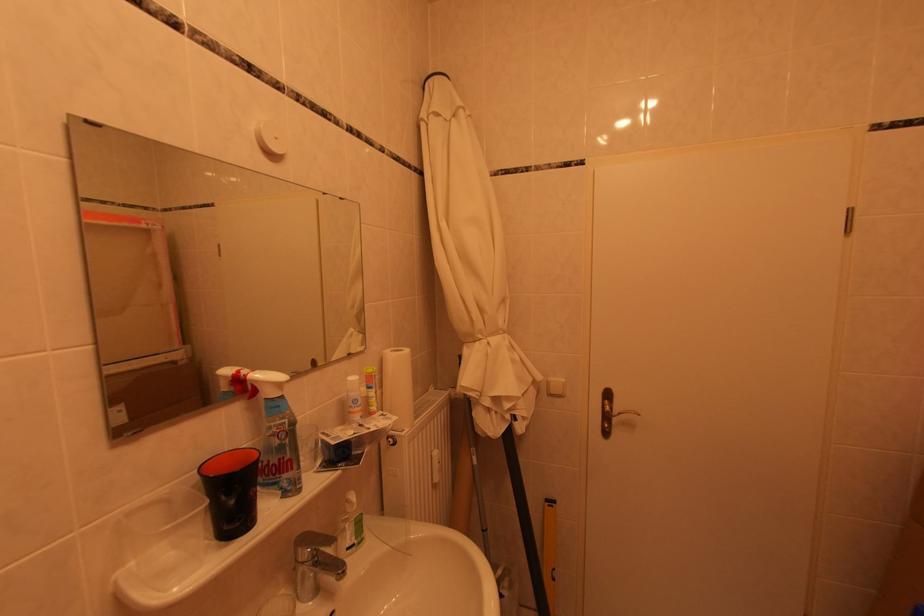
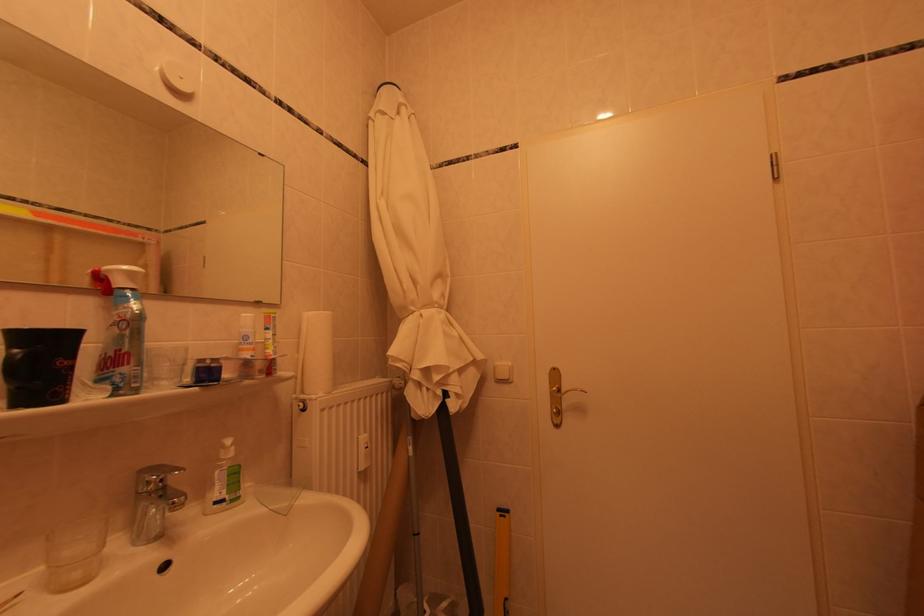
Locate, in the second image, the point that corresponds to (625,416) in the first image.

(572, 395)